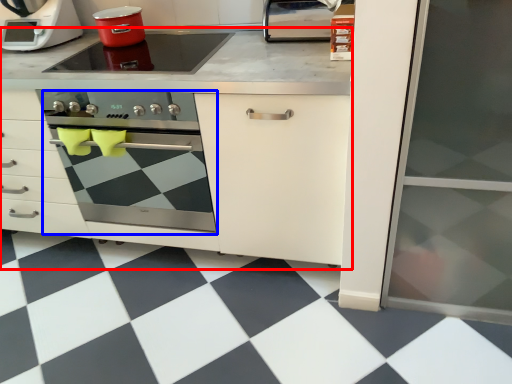
Question: Which of the following is the closest to the observer, cabinetry (highlighted by a red box) or oven (highlighted by a blue box)?

Choices:
 (A) cabinetry
 (B) oven

Answer: (A)